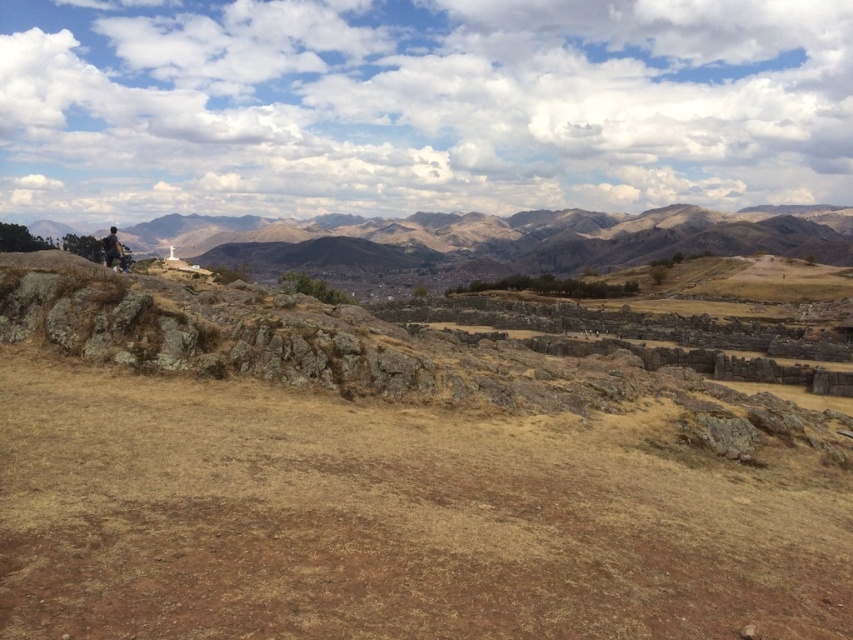
How much distance is there between brown rocky mountain at left and dark brown stone statue at left?

They are 409.47 meters apart.

Locate an element on the screen. This screenshot has height=640, width=853. brown rocky mountain at left is located at coordinates (498, 240).

Image resolution: width=853 pixels, height=640 pixels. I want to click on brown rocky mountain at left, so click(x=498, y=240).